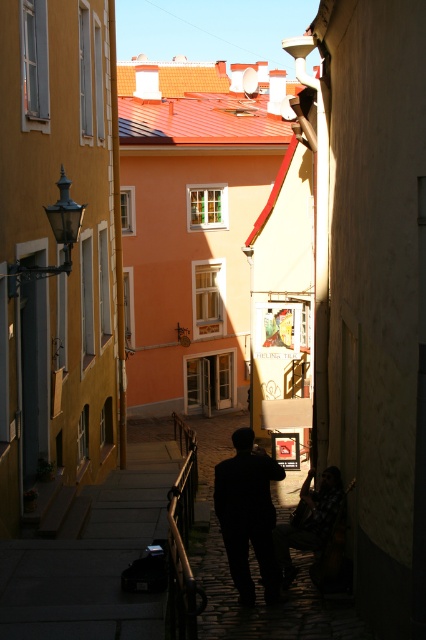
You are a delivery person carrying a box that is 24 inches wide. You see a silhouette dark clothing at center and a dark fabric jacket at center in the alleyway. Can you pass through the space between them with your box?

The space between the silhouette dark clothing at center and the dark fabric jacket at center is 25.10 inches. Since your box is 24 inches wide, it should fit through the space as it is slightly wider than the box.

You are a delivery person standing at the entrance of the alley. You see two people in dark clothing at the center of the alley. Which one is closer to you, the silhouette dark clothing at center or the dark fabric jacket at center?

The silhouette dark clothing at center is closer to the viewer than the dark fabric jacket at center, so the silhouette dark clothing at center is closer to you.

You are a photographer standing in the middle of the alleyway. You notice two people dressed in dark clothing. One is wearing a silhouette dark clothing at center and the other is wearing a dark fabric jacket at center. Which one is positioned to the left when facing the buildings?

The silhouette dark clothing at center is positioned to the left of the dark fabric jacket at center.